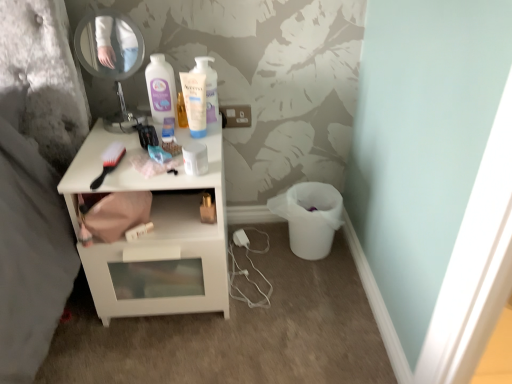
Question: From the image's perspective, would you say black plastic brush at upper left is positioned over metallic round mirror at upper left?

Choices:
 (A) no
 (B) yes

Answer: (A)

Question: Can you confirm if black plastic brush at upper left is positioned to the right of metallic round mirror at upper left?

Choices:
 (A) yes
 (B) no

Answer: (A)

Question: From a real-world perspective, is black plastic brush at upper left located higher than metallic round mirror at upper left?

Choices:
 (A) no
 (B) yes

Answer: (A)

Question: Is black plastic brush at upper left not within metallic round mirror at upper left?

Choices:
 (A) yes
 (B) no

Answer: (A)

Question: Does black plastic brush at upper left have a smaller size compared to metallic round mirror at upper left?

Choices:
 (A) yes
 (B) no

Answer: (A)

Question: Is point (166, 251) closer or farther from the camera than point (87, 39)?

Choices:
 (A) closer
 (B) farther

Answer: (A)

Question: From the image's perspective, is white glossy nightstand at center located above or below metallic round mirror at upper left?

Choices:
 (A) below
 (B) above

Answer: (A)

Question: Is white glossy nightstand at center inside the boundaries of metallic round mirror at upper left, or outside?

Choices:
 (A) inside
 (B) outside

Answer: (B)

Question: Considering their positions, is white glossy nightstand at center located in front of or behind metallic round mirror at upper left?

Choices:
 (A) front
 (B) behind

Answer: (A)

Question: Considering the positions of black plastic brush at upper left and white glossy nightstand at center in the image, is black plastic brush at upper left wider or thinner than white glossy nightstand at center?

Choices:
 (A) wide
 (B) thin

Answer: (B)

Question: Considering their positions, is black plastic brush at upper left located in front of or behind white glossy nightstand at center?

Choices:
 (A) behind
 (B) front

Answer: (B)

Question: From the image's perspective, is black plastic brush at upper left above or below white glossy nightstand at center?

Choices:
 (A) above
 (B) below

Answer: (A)

Question: From their relative heights in the image, would you say black plastic brush at upper left is taller or shorter than white glossy nightstand at center?

Choices:
 (A) tall
 (B) short

Answer: (B)

Question: From a real-world perspective, is metallic round mirror at upper left above or below white glossy nightstand at center?

Choices:
 (A) below
 (B) above

Answer: (B)

Question: In the image, is metallic round mirror at upper left positioned in front of or behind white glossy nightstand at center?

Choices:
 (A) front
 (B) behind

Answer: (B)